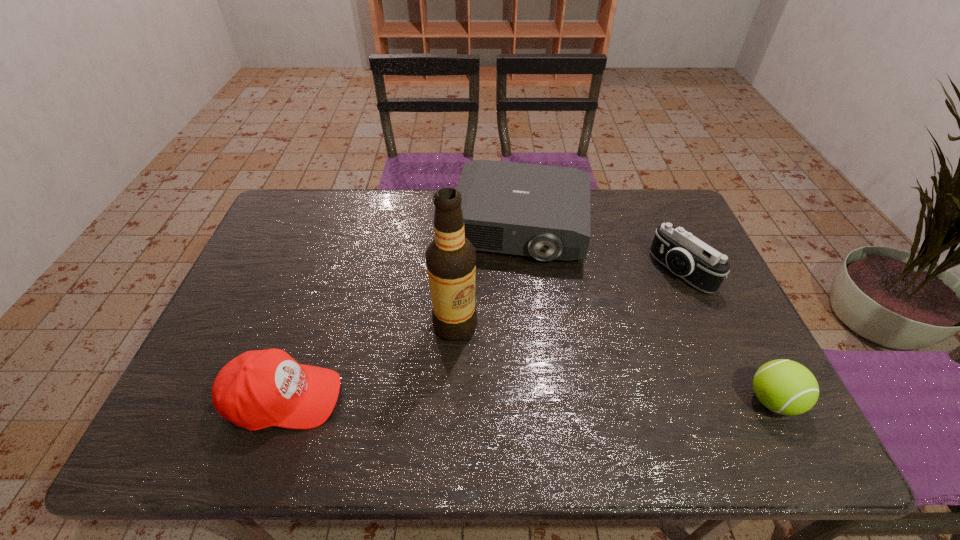
You are a GUI agent. You are given a task and a screenshot of the screen. Output one action in this format:
    pyautogui.click(x=<x>, y=<y>)
    Task: Click on the empty space that is in between the tennis ball and the projector
    This screenshot has width=960, height=540.
    Given the screenshot: What is the action you would take?
    pyautogui.click(x=646, y=313)

This screenshot has height=540, width=960. Find the location of `blank region between the camera and the projector`. blank region between the camera and the projector is located at coordinates (600, 248).

At what (x,y) coordinates should I click in order to perform the action: click on free space between the camera and the alcohol. Please return your answer as a coordinate pair (x, y). Image resolution: width=960 pixels, height=540 pixels. Looking at the image, I should click on (568, 298).

Image resolution: width=960 pixels, height=540 pixels. I want to click on vacant region between the third farthest object and the baseball cap, so coord(370,361).

Where is `empty space that is in between the tennis ball and the baseball cap`? The height and width of the screenshot is (540, 960). empty space that is in between the tennis ball and the baseball cap is located at coordinates pyautogui.click(x=528, y=400).

The image size is (960, 540). What are the coordinates of `vacant space that's between the projector and the tennis ball` in the screenshot? It's located at (646, 313).

Where is `vacant point located between the projector and the leftmost object`? The height and width of the screenshot is (540, 960). vacant point located between the projector and the leftmost object is located at coordinates (401, 312).

Where is `vacant region between the projector and the camera`? The width and height of the screenshot is (960, 540). vacant region between the projector and the camera is located at coordinates (600, 248).

Locate an element on the screen. The image size is (960, 540). object that stands as the second closest to the leftmost object is located at coordinates (542, 211).

Find the location of a particular element. Image resolution: width=960 pixels, height=540 pixels. the closest object to the baseball cap is located at coordinates coord(451,258).